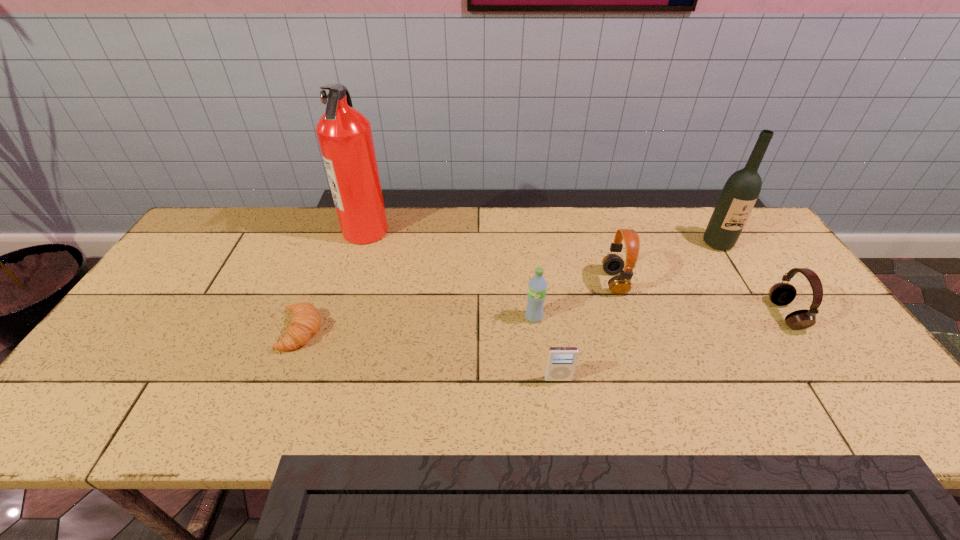
What are the coordinates of `free space at the near right corner` in the screenshot? It's located at [895, 413].

Identify the location of vacant space that's between the taller headset and the fifth tallest object. (700, 299).

At what (x,y) coordinates should I click in order to perform the action: click on free space between the nearest object and the fire extinguisher. Please return your answer as a coordinate pair (x, y). Looking at the image, I should click on (462, 305).

Where is `vacant region between the shorter headset and the fire extinguisher`? vacant region between the shorter headset and the fire extinguisher is located at coordinates (576, 273).

You are a GUI agent. You are given a task and a screenshot of the screen. Output one action in this format:
    pyautogui.click(x=<x>, y=<y>)
    Task: Click on the vacant space in between the fire extinguisher and the water bottle
    Image resolution: width=960 pixels, height=540 pixels.
    Given the screenshot: What is the action you would take?
    pyautogui.click(x=450, y=274)

You are a GUI agent. You are given a task and a screenshot of the screen. Output one action in this format:
    pyautogui.click(x=<x>, y=<y>)
    Task: Click on the unoccupied area between the shortest object and the left headset
    The width and height of the screenshot is (960, 540).
    Given the screenshot: What is the action you would take?
    pyautogui.click(x=457, y=307)

Where is `vacant area that lies between the wine bottle and the sixth tallest object`? The image size is (960, 540). vacant area that lies between the wine bottle and the sixth tallest object is located at coordinates (637, 311).

You are a GUI agent. You are given a task and a screenshot of the screen. Output one action in this format:
    pyautogui.click(x=<x>, y=<y>)
    Task: Click on the free point between the left headset and the shorter headset
    This screenshot has width=960, height=540.
    Given the screenshot: What is the action you would take?
    pyautogui.click(x=700, y=299)

At what (x,y) coordinates should I click in order to perform the action: click on free space between the iPod and the shortest object. Please return your answer as a coordinate pair (x, y). The image size is (960, 540). Looking at the image, I should click on (429, 355).

In order to click on vacant region between the third object from right to left and the sixth shortest object in this screenshot , I will do `click(666, 263)`.